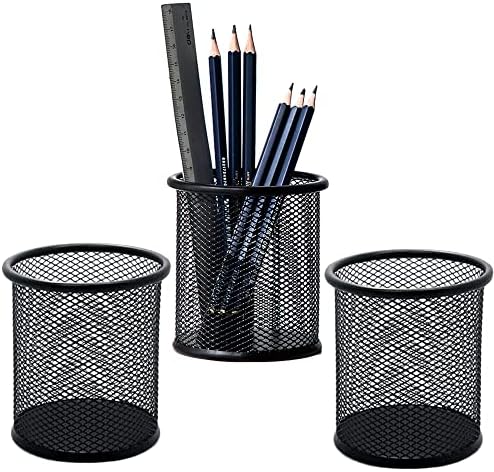
Where is `sharpened pencils, points up`? The width and height of the screenshot is (494, 472). sharpened pencils, points up is located at coordinates (216, 91), (232, 89), (247, 89), (272, 126), (285, 131), (303, 140).